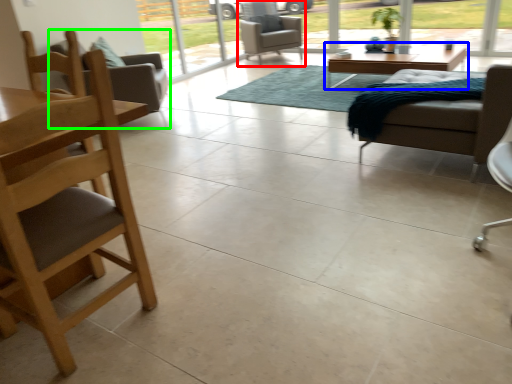
Question: Which object is the farthest from chair (highlighted by a red box)? Choose among these: coffee table (highlighted by a blue box) or chair (highlighted by a green box).

Choices:
 (A) coffee table
 (B) chair

Answer: (B)